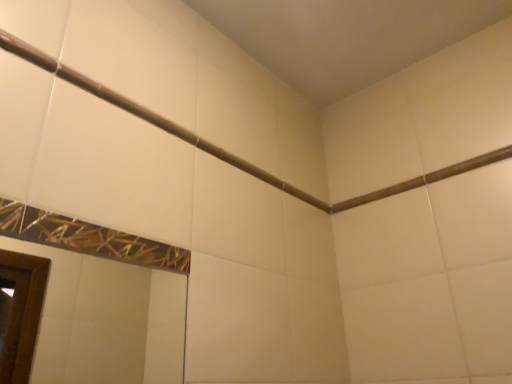
Question: Is brown matte beam at upper center not near matte white shower at upper left?

Choices:
 (A) yes
 (B) no

Answer: (B)

Question: From the image's perspective, is brown matte beam at upper center on top of matte white shower at upper left?

Choices:
 (A) yes
 (B) no

Answer: (B)

Question: Considering the relative positions of brown matte beam at upper center and matte white shower at upper left in the image provided, is brown matte beam at upper center behind matte white shower at upper left?

Choices:
 (A) no
 (B) yes

Answer: (B)

Question: Does brown matte beam at upper center turn towards matte white shower at upper left?

Choices:
 (A) no
 (B) yes

Answer: (B)

Question: Does brown matte beam at upper center appear on the right side of matte white shower at upper left?

Choices:
 (A) yes
 (B) no

Answer: (A)

Question: Is brown matte beam at upper center beside matte white shower at upper left?

Choices:
 (A) yes
 (B) no

Answer: (B)

Question: Is brown matte beam at upper center a part of matte white shower at upper left?

Choices:
 (A) yes
 (B) no

Answer: (B)

Question: Is the depth of matte white shower at upper left greater than that of brown matte beam at upper center?

Choices:
 (A) yes
 (B) no

Answer: (B)

Question: Considering the relative sizes of matte white shower at upper left and brown matte beam at upper center in the image provided, is matte white shower at upper left shorter than brown matte beam at upper center?

Choices:
 (A) no
 (B) yes

Answer: (A)

Question: Considering the relative positions of matte white shower at upper left and brown matte beam at upper center in the image provided, is matte white shower at upper left in front of brown matte beam at upper center?

Choices:
 (A) yes
 (B) no

Answer: (A)

Question: From the image's perspective, is matte white shower at upper left located beneath brown matte beam at upper center?

Choices:
 (A) no
 (B) yes

Answer: (A)

Question: Considering the relative sizes of matte white shower at upper left and brown matte beam at upper center in the image provided, is matte white shower at upper left bigger than brown matte beam at upper center?

Choices:
 (A) yes
 (B) no

Answer: (A)

Question: Choose the correct answer: Is matte white shower at upper left inside brown matte beam at upper center or outside it?

Choices:
 (A) outside
 (B) inside

Answer: (A)